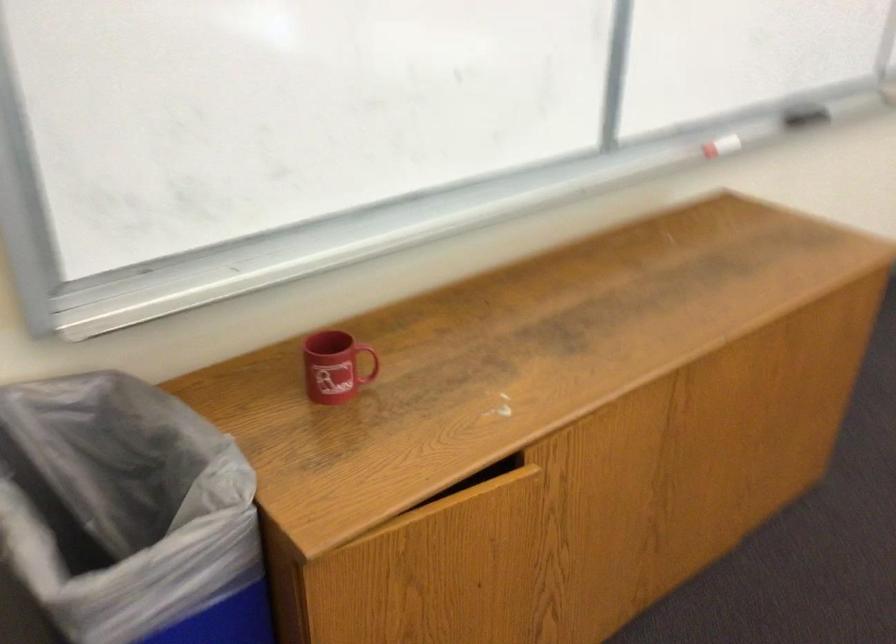
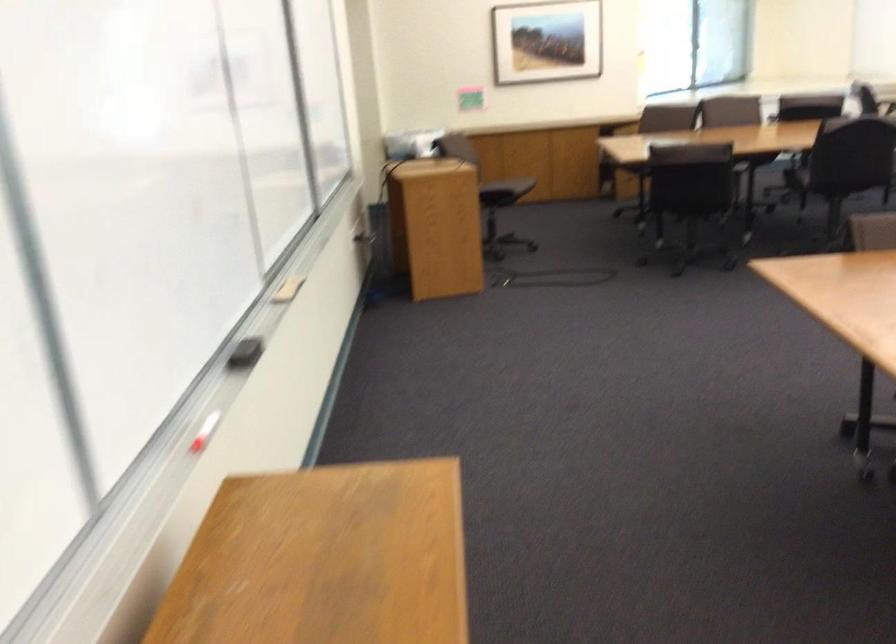
The point at (x=724, y=144) is marked in the first image. Where is the corresponding point in the second image?

(205, 431)